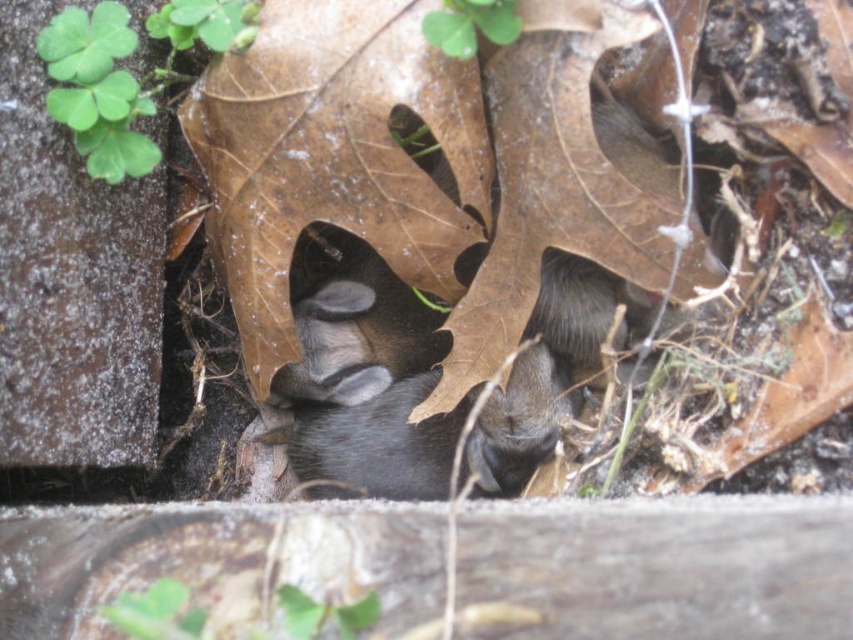
You are an animal tracker trying to locate a hidden animal in the scene. Based on the black fur at center, can you estimate its approximate position using a coordinate system where the bottom left corner is the origin?

The black fur at center is located at the 2D coordinates of point (373, 435), so the animal is likely positioned near that point.

You are a wildlife photographer trying to capture a clear image of the animal in the scene. You notice two instances of black fur at center and black matte fur at center. Which one is closer to the camera?

The black fur at center is closer to the camera because the black matte fur at center is behind it.